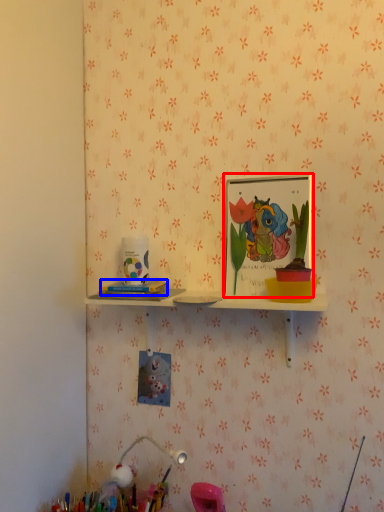
Question: Which object is further to the camera taking this photo, picture frame (highlighted by a red box) or stationery (highlighted by a blue box)?

Choices:
 (A) picture frame
 (B) stationery

Answer: (B)